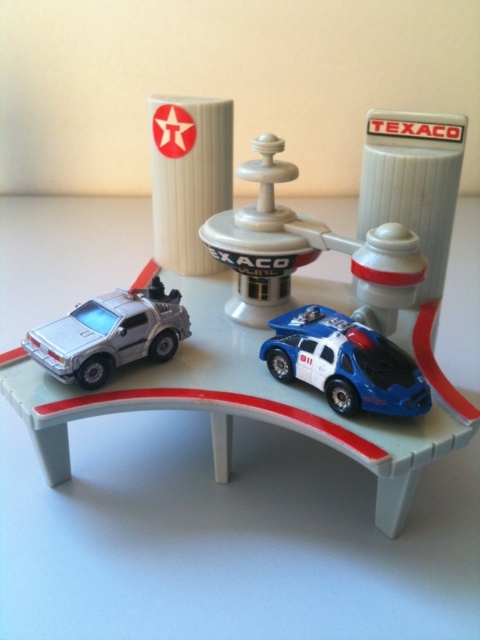
Question: Can you confirm if white plastic track at center is wider than white plastic texaco gas station at center?

Choices:
 (A) yes
 (B) no

Answer: (A)

Question: Which of the following is the closest to the observer?

Choices:
 (A) white plastic texaco gas station at center
 (B) blue glossy police car at center

Answer: (B)

Question: Which of these objects is positioned farthest from the blue glossy police car at center?

Choices:
 (A) silver metallic delorean at left
 (B) white plastic texaco gas station at center
 (C) white plastic track at center

Answer: (C)

Question: Is the position of white plastic track at center more distant than that of silver metallic delorean at left?

Choices:
 (A) no
 (B) yes

Answer: (B)

Question: Which object is the closest to the silver metallic delorean at left?

Choices:
 (A) white plastic track at center
 (B) blue glossy police car at center

Answer: (B)

Question: In this image, where is white plastic texaco gas station at center located relative to blue glossy police car at center?

Choices:
 (A) below
 (B) above

Answer: (B)